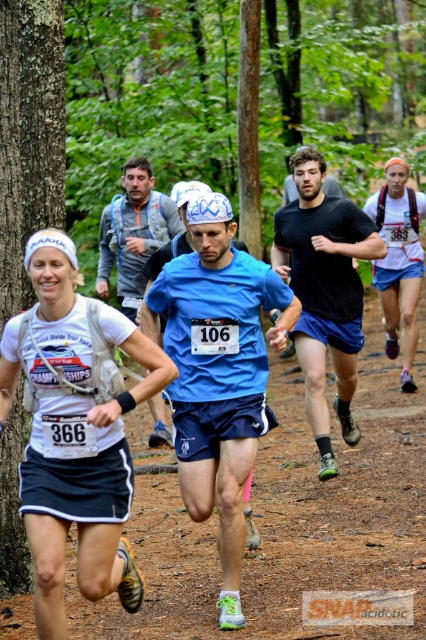
Can you confirm if black matte running shoe at center is smaller than blue fabric shirt at center?

Actually, black matte running shoe at center might be larger than blue fabric shirt at center.

Where is `black matte running shoe at center`? The image size is (426, 640). black matte running shoe at center is located at coordinates (325, 292).

Looking at this image, is white fabric shirt at left to the left of black matte running shoe at center from the viewer's perspective?

Indeed, white fabric shirt at left is positioned on the left side of black matte running shoe at center.

Who is higher up, white fabric shirt at left or black matte running shoe at center?

Positioned higher is black matte running shoe at center.

At what (x,y) coordinates should I click in order to perform the action: click on white fabric shirt at left. Please return your answer as a coordinate pair (x, y). Image resolution: width=426 pixels, height=640 pixels. Looking at the image, I should click on [88, 484].

Locate an element on the screen. The width and height of the screenshot is (426, 640). white fabric shirt at left is located at coordinates point(88,484).

Can you confirm if white fabric shirt at left is positioned below blue fabric shirt at center?

Yes, white fabric shirt at left is below blue fabric shirt at center.

Does white fabric shirt at left have a greater height compared to blue fabric shirt at center?

Yes.

Is point (77, 449) positioned behind point (112, 232)?

No, (77, 449) is in front of (112, 232).

The width and height of the screenshot is (426, 640). In order to click on white fabric shirt at left in this screenshot , I will do `click(88, 484)`.